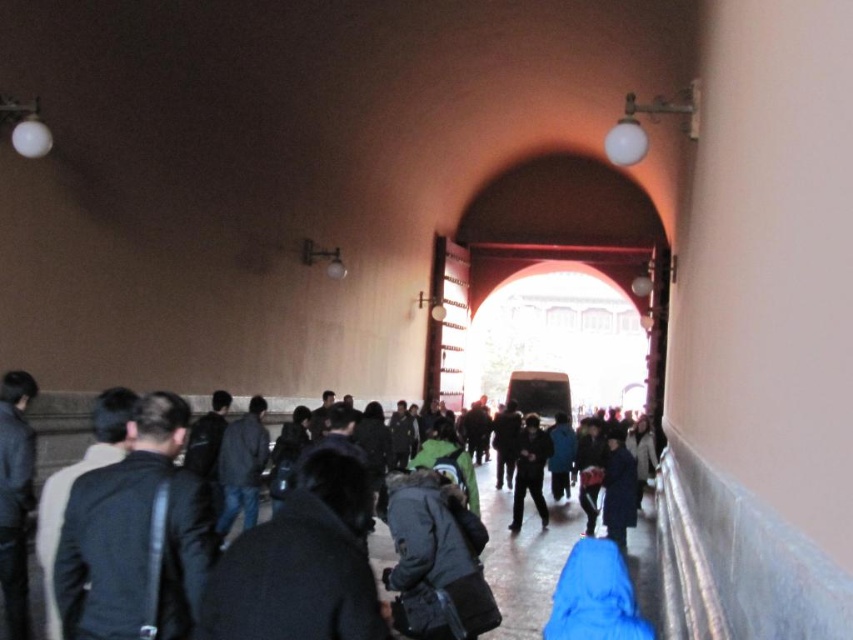
You are a visitor at this historical site and want to place a small souvenir on the floor between the black fabric jacket at left and the dark gray jacket at center. Is there enough space for the souvenir?

The black fabric jacket at left occupies less space than the dark gray jacket at center, so there is sufficient space between them to place the souvenir.

You are a visitor at this historical site and need to decide which item to take with you. Both the dark gray coat at center and the dark gray jacket at center are available. If you prefer a wider garment for comfort, which one should you choose?

The dark gray coat at center is wider than the dark gray jacket at center, so you should choose the dark gray coat at center for a wider garment.